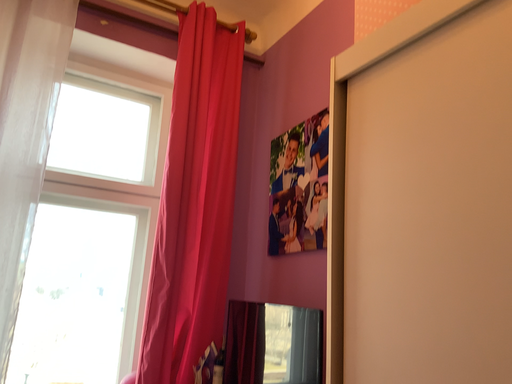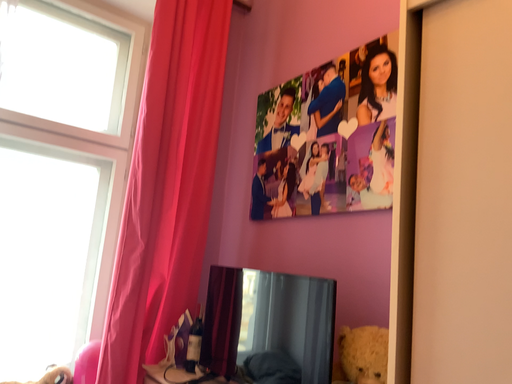
Question: Which way did the camera rotate in the video?

Choices:
 (A) rotated left
 (B) rotated right

Answer: (B)